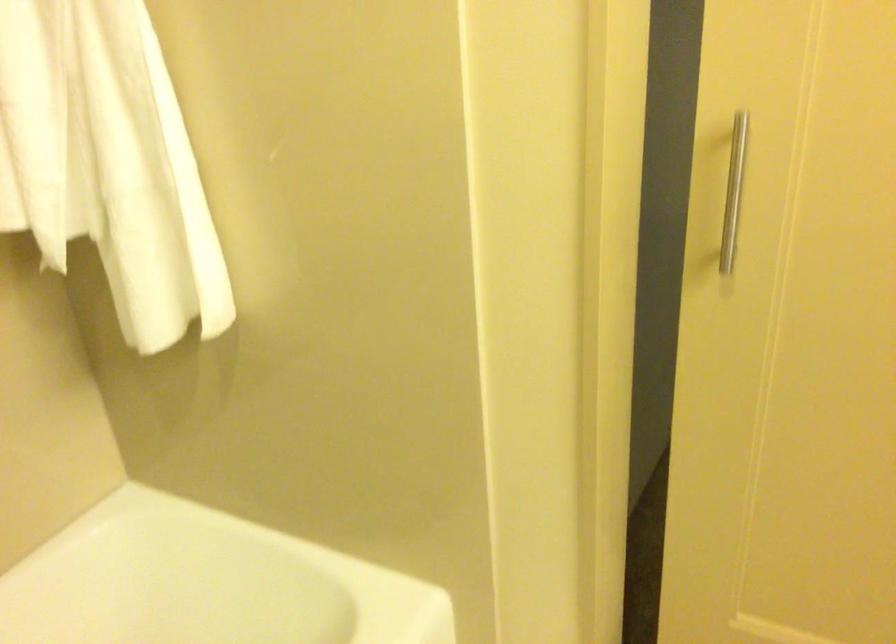
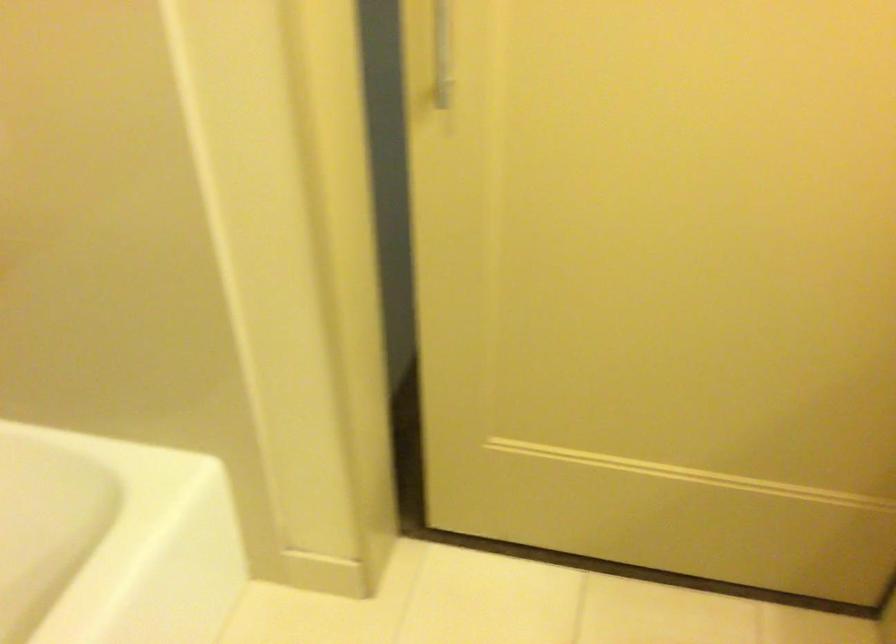
Question: The first image is from the beginning of the video and the second image is from the end. How did the camera likely rotate when shooting the video?

Choices:
 (A) Left
 (B) Right
 (C) Up
 (D) Down

Answer: (B)